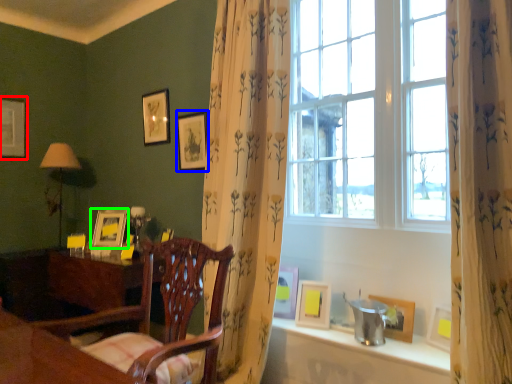
Question: Which is farther away from picture frame (highlighted by a red box)? picture frame (highlighted by a blue box) or picture frame (highlighted by a green box)?

Choices:
 (A) picture frame
 (B) picture frame

Answer: (A)